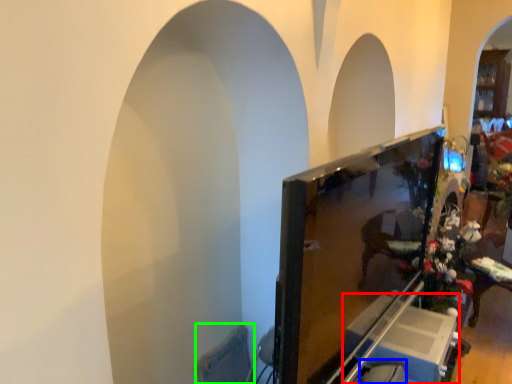
Question: Which object is the closest to the furniture (highlighted by a red box)? Choose among these: swivel chair (highlighted by a blue box) or swivel chair (highlighted by a green box).

Choices:
 (A) swivel chair
 (B) swivel chair

Answer: (A)